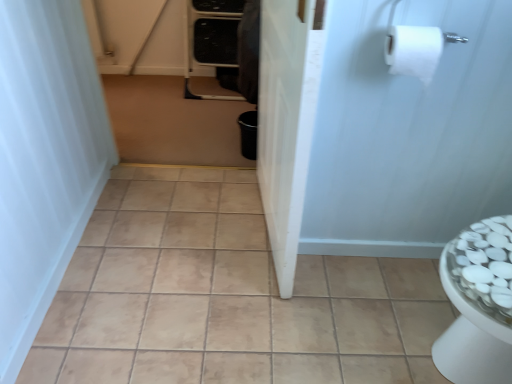
The height and width of the screenshot is (384, 512). Identify the location of free space above brown matte trash can at center (from a real-world perspective). (178, 110).